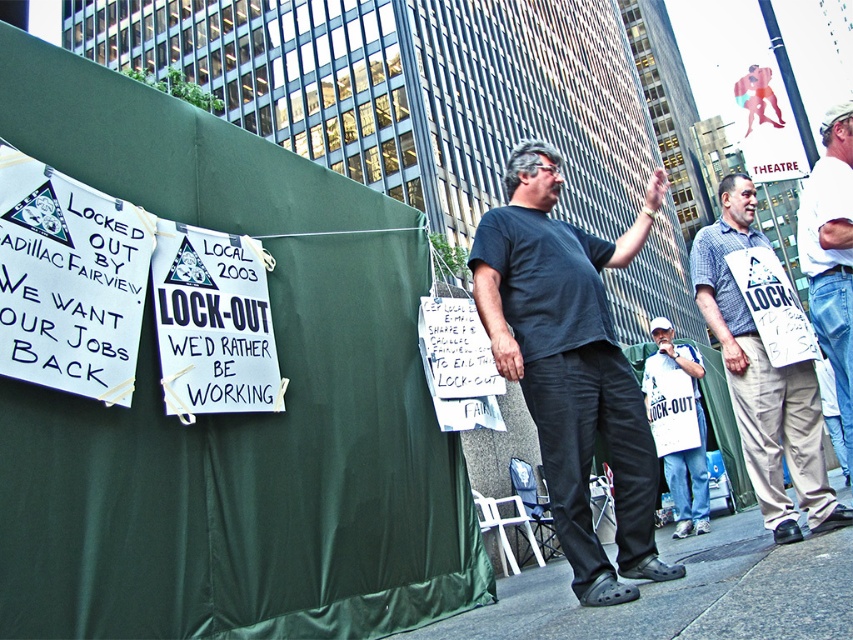
Which is more to the left, plaid shirt at center or white paper sign at lower right?

From the viewer's perspective, plaid shirt at center appears more on the left side.

Who is lower down, plaid shirt at center or white paper sign at lower right?

white paper sign at lower right is below.

Where is `plaid shirt at center`? plaid shirt at center is located at coordinates (762, 378).

Where is `plaid shirt at center`? plaid shirt at center is located at coordinates (762, 378).

Who is higher up, dark gray t-shirt at center or white denim jeans at right?

white denim jeans at right

In the scene shown: Who is taller, dark gray t-shirt at center or white denim jeans at right?

dark gray t-shirt at center

Locate an element on the screen. This screenshot has height=640, width=853. dark gray t-shirt at center is located at coordinates (572, 364).

Does dark gray t-shirt at center come behind gray concrete sidewalk at lower center?

Yes, it is.

In the scene shown: Who is more forward, (624, 573) or (762, 612)?

Point (762, 612)

What do you see at coordinates (572, 364) in the screenshot? The height and width of the screenshot is (640, 853). I see `dark gray t-shirt at center` at bounding box center [572, 364].

Locate an element on the screen. Image resolution: width=853 pixels, height=640 pixels. dark gray t-shirt at center is located at coordinates (572, 364).